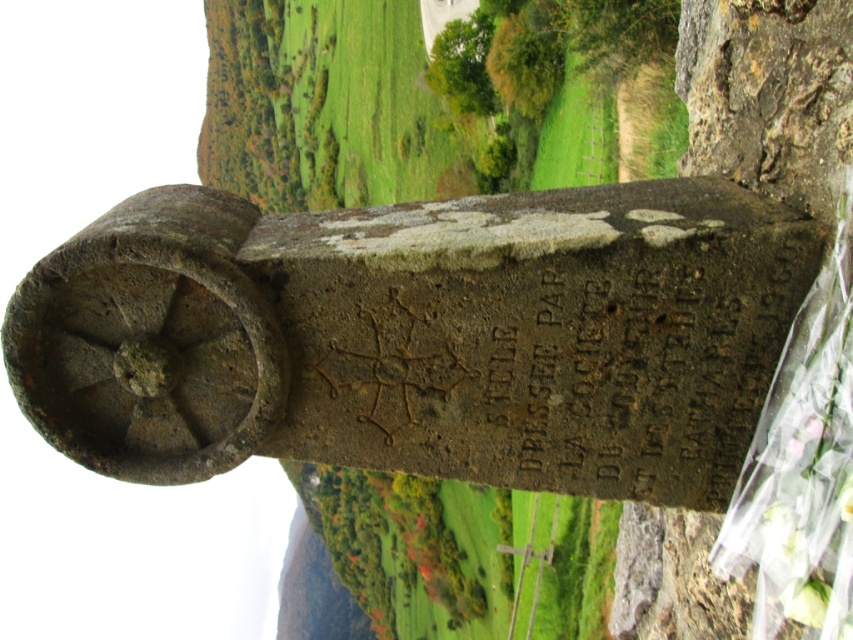
You are standing in front of the monument and want to place a flower bouquet at the base of the rusty stone gravestone at center. If you are currently 12 feet away from the gravestone, will you need to move closer to place the bouquet?

The rusty stone gravestone at center is 11.76 feet from viewer. Since you are currently 12 feet away, you are slightly farther than the actual distance, so you need to move about 0.24 feet closer to reach the gravestone.